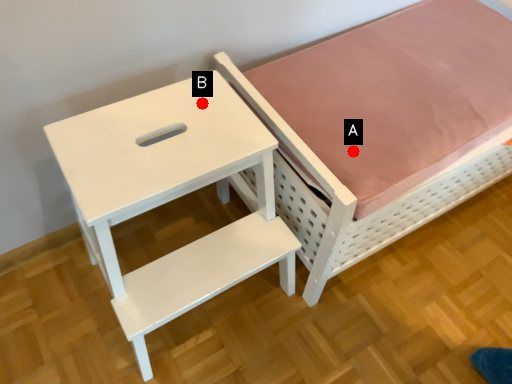
Question: Two points are circled on the image, labeled by A and B beside each circle. Which of the following is the closest to the observer?

Choices:
 (A) A is closer
 (B) B is closer

Answer: (B)